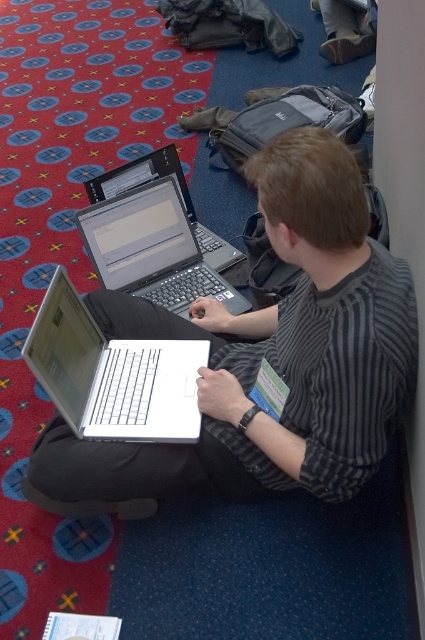
You are organizing a tech event and need to place two laptops on a table. The white plastic laptop at center and the white matte laptop at center must be placed side by side. The table has a width of 1.2 meters. If the combined width of both laptops is exactly 1 meter, will there be enough space between them if you leave a 10 cm gap?

The combined width of the white plastic laptop at center and the white matte laptop at center is exactly 1 meter. Adding a 10 cm gap would require 1.1 meters of space. Since the table is 1.2 meters wide, there will be enough space between them with 10 cm gap remaining.

You are a conference attendee who needs to quickly switch between two laptops. The white plastic laptop at center and the white matte laptop at center are both in front of you. Which one is positioned to your right side?

The white plastic laptop at center is positioned to the right of the white matte laptop at center, so the white plastic laptop at center is on your right side.